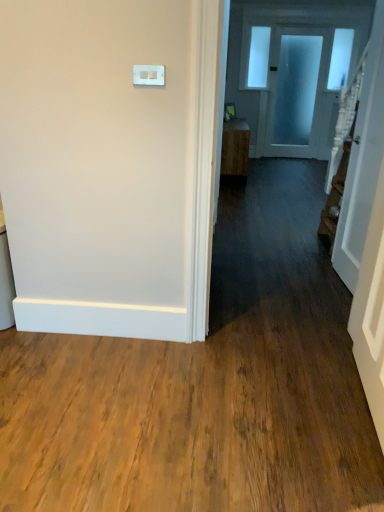
Question: Is white glossy door at right, positioned as the 2th door in top-to-bottom order, behind wooden cabinet at center?

Choices:
 (A) yes
 (B) no

Answer: (B)

Question: Is white glossy door at right, which appears as the second door when viewed from the back, turned away from wooden cabinet at center?

Choices:
 (A) yes
 (B) no

Answer: (B)

Question: Does white glossy door at right, acting as the first door starting from the front, have a lesser height compared to wooden cabinet at center?

Choices:
 (A) no
 (B) yes

Answer: (A)

Question: Is the depth of white glossy door at right, which is the second door from right to left, less than that of wooden cabinet at center?

Choices:
 (A) yes
 (B) no

Answer: (A)

Question: Considering the relative sizes of white glossy door at right, positioned as the 2th door in top-to-bottom order, and wooden cabinet at center in the image provided, is white glossy door at right, positioned as the 2th door in top-to-bottom order, thinner than wooden cabinet at center?

Choices:
 (A) yes
 (B) no

Answer: (A)

Question: Is wooden cabinet at center taller or shorter than white glossy door at right, positioned as the 2th door in top-to-bottom order?

Choices:
 (A) tall
 (B) short

Answer: (B)

Question: Does point (238, 167) appear closer or farther from the camera than point (370, 175)?

Choices:
 (A) closer
 (B) farther

Answer: (B)

Question: Would you say wooden cabinet at center is to the left or to the right of white glossy door at right, which is the second door from right to left, in the picture?

Choices:
 (A) left
 (B) right

Answer: (A)

Question: Looking at their shapes, would you say wooden cabinet at center is wider or thinner than white glossy door at right, arranged as the 1th door when viewed from the left?

Choices:
 (A) wide
 (B) thin

Answer: (A)

Question: Looking at their shapes, would you say white plastic light switch at upper center is wider or thinner than frosted glass door at upper center, placed as the 1th door when sorted from back to front?

Choices:
 (A) thin
 (B) wide

Answer: (A)

Question: Based on their positions, is white plastic light switch at upper center located to the left or right of frosted glass door at upper center, the first door viewed from the right?

Choices:
 (A) left
 (B) right

Answer: (A)

Question: In terms of size, does white plastic light switch at upper center appear bigger or smaller than frosted glass door at upper center, the 2th door when ordered from bottom to top?

Choices:
 (A) big
 (B) small

Answer: (B)

Question: Choose the correct answer: Is white plastic light switch at upper center inside frosted glass door at upper center, which appears as the 2th door when viewed from the front, or outside it?

Choices:
 (A) outside
 (B) inside

Answer: (A)

Question: Based on their positions, is frosted glass door at upper center, placed as the 1th door when sorted from back to front, located to the left or right of wooden cabinet at center?

Choices:
 (A) left
 (B) right

Answer: (B)

Question: From a real-world perspective, is frosted glass door at upper center, the 1th door from the top, above or below wooden cabinet at center?

Choices:
 (A) below
 (B) above

Answer: (B)